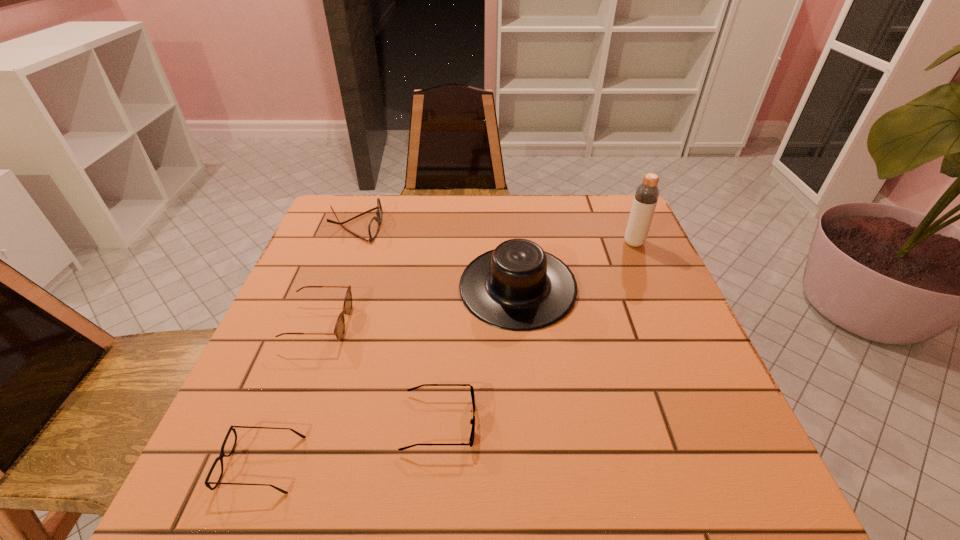
Locate an element on the screen. The image size is (960, 540). free space between the dress hat and the farthest spectacles is located at coordinates (437, 256).

The image size is (960, 540). I want to click on object that is the second nearest to the dress hat, so click(646, 196).

Select which object appears as the fifth closest to the dress hat. Please provide its 2D coordinates. Your answer should be formatted as a tuple, i.e. [(x, y)], where the tuple contains the x and y coordinates of a point satisfying the conditions above.

[(207, 482)]

Image resolution: width=960 pixels, height=540 pixels. I want to click on spectacles that is the second closest to the second farthest spectacles, so click(x=207, y=482).

Point out which spectacles is positioned as the nearest to the rightmost spectacles. Please provide its 2D coordinates. Your answer should be formatted as a tuple, i.e. [(x, y)], where the tuple contains the x and y coordinates of a point satisfying the conditions above.

[(207, 482)]

Image resolution: width=960 pixels, height=540 pixels. I want to click on vacant position in the image that satisfies the following two spatial constraints: 1. on the front-facing side of the farthest spectacles; 2. on the right side of the second tallest object, so point(332,288).

This screenshot has width=960, height=540. In order to click on vacant space that satisfies the following two spatial constraints: 1. on the front-facing side of the farthest spectacles; 2. on the right side of the bottle in this screenshot , I will do `click(349, 243)`.